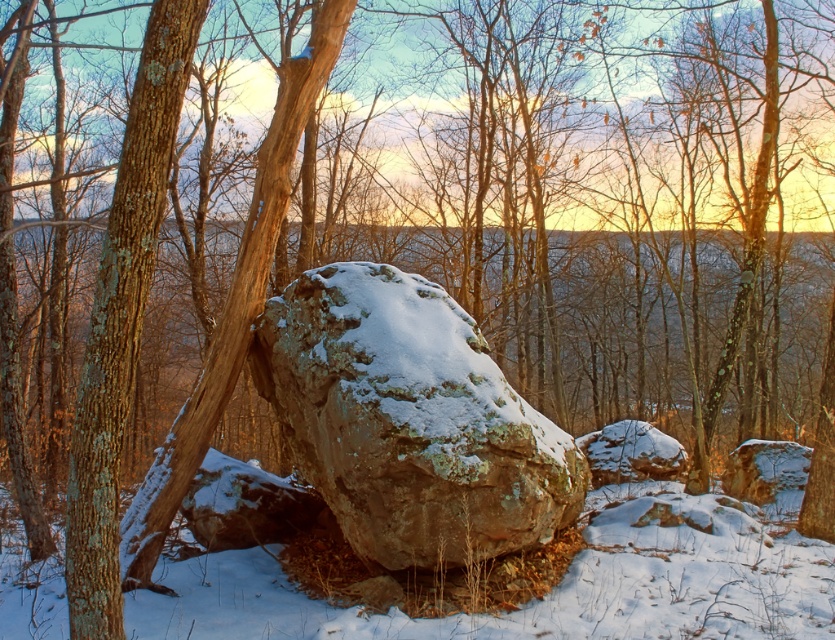
Question: Can you confirm if snowy gray rock at center is positioned to the right of smooth brown tree trunk at left?

Choices:
 (A) yes
 (B) no

Answer: (A)

Question: Observing the image, what is the correct spatial positioning of snowy gray rock at center in reference to smooth brown tree trunk at left?

Choices:
 (A) right
 (B) left

Answer: (A)

Question: Does snowy gray rock at center appear on the right side of smooth brown tree trunk at left?

Choices:
 (A) no
 (B) yes

Answer: (B)

Question: Which point appears closest to the camera in this image?

Choices:
 (A) (272, 385)
 (B) (148, 252)

Answer: (B)

Question: Which of the following is the farthest from the observer?

Choices:
 (A) (114, 504)
 (B) (403, 566)

Answer: (B)